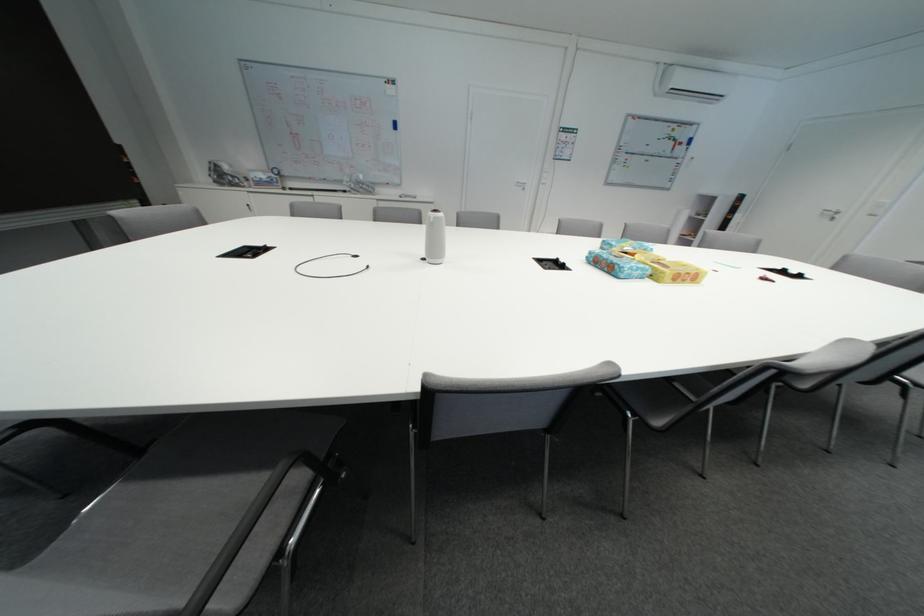
The height and width of the screenshot is (616, 924). I want to click on white cylindrical speaker, so click(434, 237).